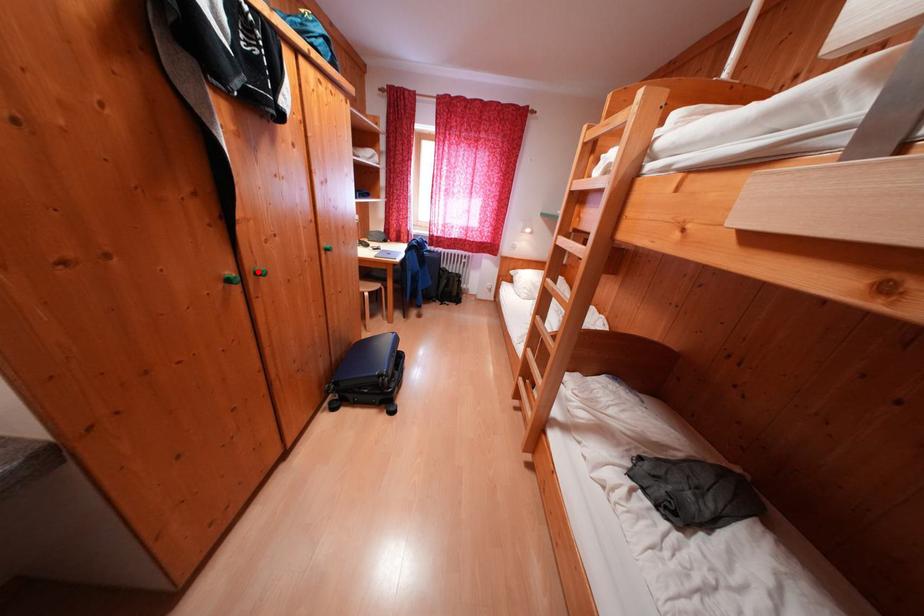
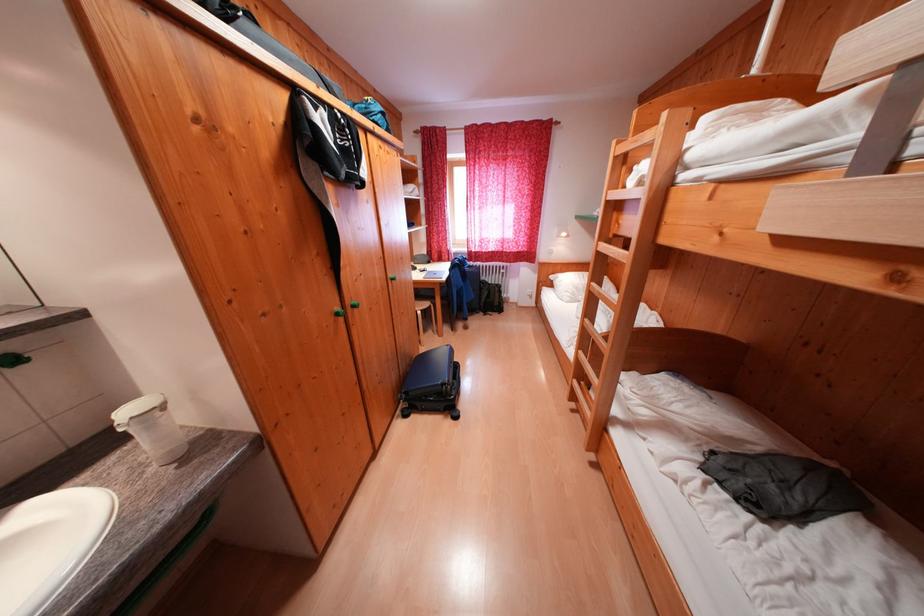
The point at the highlighted location is marked in the first image. Where is the corresponding point in the second image?

(357, 306)